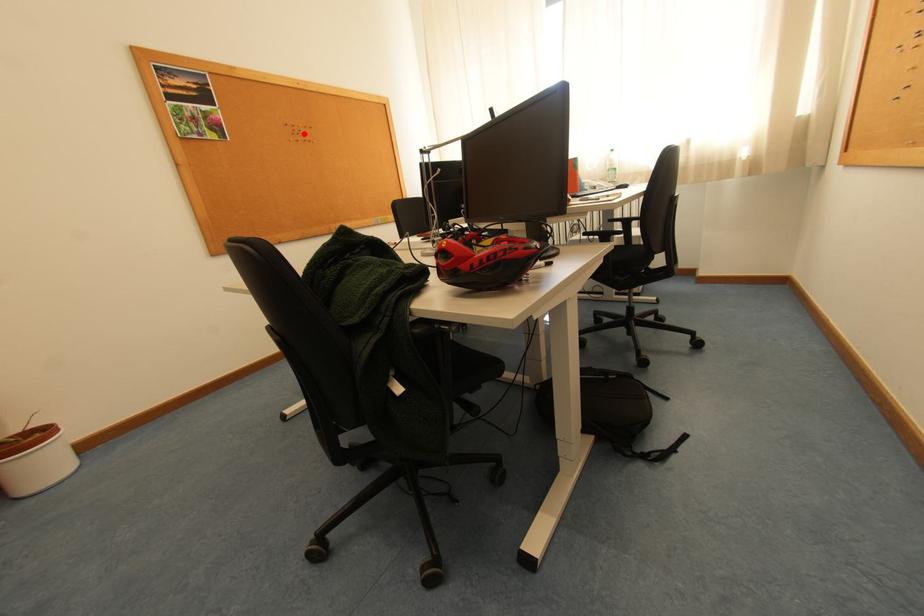
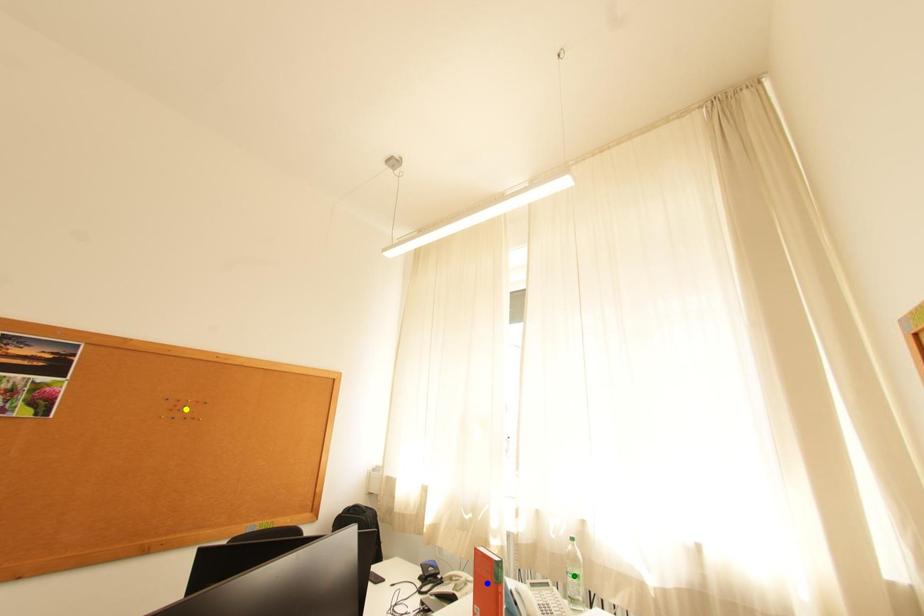
Question: I am providing you with two images of the same scene from different viewpoints. A red point is marked on the first image. You are given multiple points on the second image. Which mark in image 2 goes with the point in image 1?

Choices:
 (A) green point
 (B) blue point
 (C) yellow point

Answer: (C)